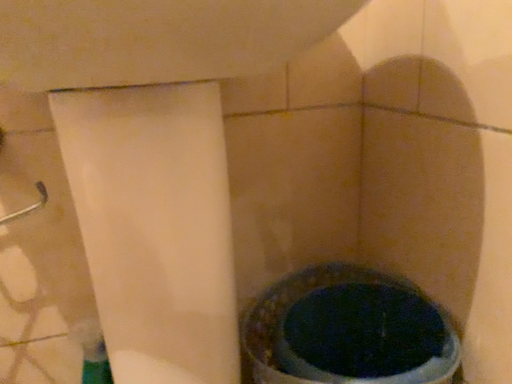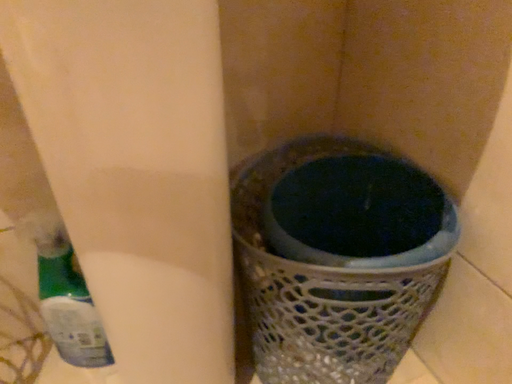
Question: How did the camera likely rotate when shooting the video?

Choices:
 (A) rotated upward
 (B) rotated downward

Answer: (B)